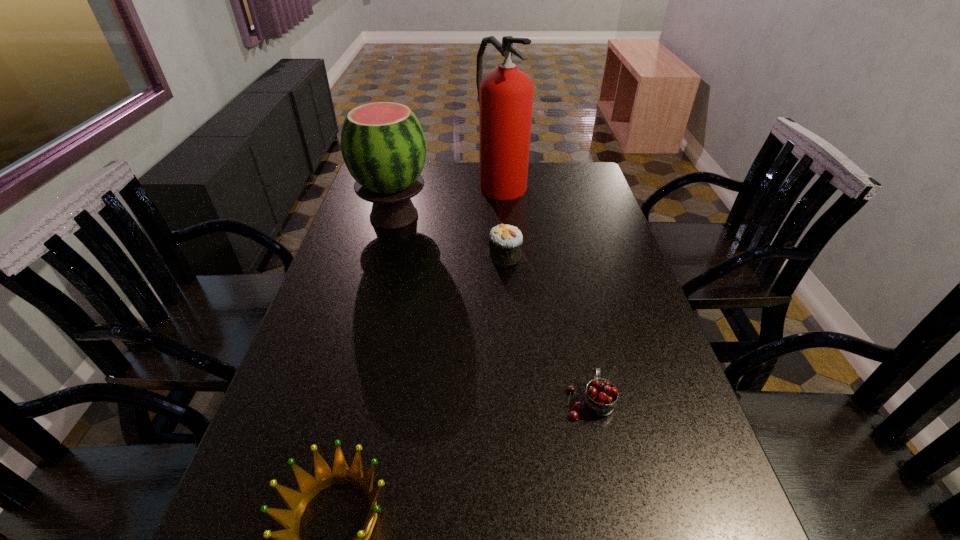
This screenshot has height=540, width=960. What are the coordinates of `fire extinguisher` in the screenshot? It's located at (505, 95).

In order to click on the second tallest object in this screenshot , I will do `click(383, 145)`.

Identify the location of cupcake. This screenshot has height=540, width=960. (505, 241).

I want to click on the fourth farthest object, so click(600, 397).

This screenshot has width=960, height=540. I want to click on the rightmost object, so click(x=600, y=397).

The image size is (960, 540). In order to click on free location located 0.140m on the handle side of the tallest object in this screenshot , I will do `click(504, 226)`.

The width and height of the screenshot is (960, 540). Find the location of `blank space located 0.210m on the front of the fourth shortest object`. blank space located 0.210m on the front of the fourth shortest object is located at coordinates (377, 282).

At what (x,y) coordinates should I click in order to perform the action: click on vacant space situated on the left of the third nearest object. Please return your answer as a coordinate pair (x, y). Looking at the image, I should click on (361, 255).

Where is `free space located 0.370m on the handle side of the cherry`? The image size is (960, 540). free space located 0.370m on the handle side of the cherry is located at coordinates (563, 275).

Where is `free spot located on the handle side of the cherry`? Image resolution: width=960 pixels, height=540 pixels. free spot located on the handle side of the cherry is located at coordinates (580, 357).